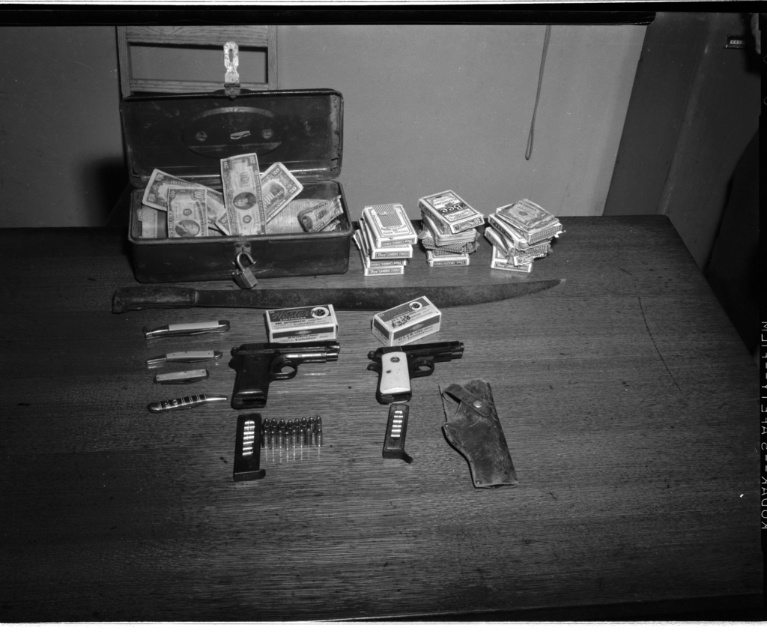
Between metallic suitcase at upper center and polished silver handgun at center, which one has more height?

metallic suitcase at upper center

Does metallic suitcase at upper center have a greater width compared to polished silver handgun at center?

Correct, the width of metallic suitcase at upper center exceeds that of polished silver handgun at center.

This screenshot has width=767, height=640. I want to click on metallic suitcase at upper center, so click(x=219, y=179).

In the scene shown: Does metallic suitcase at upper center have a lesser height compared to polished metal handgun at center?

In fact, metallic suitcase at upper center may be taller than polished metal handgun at center.

Which is in front, point (315, 136) or point (236, 381)?

Positioned in front is point (236, 381).

The width and height of the screenshot is (767, 640). Find the location of `metallic suitcase at upper center`. metallic suitcase at upper center is located at coordinates [219, 179].

Between point (334, 349) and point (392, 387), which one is positioned behind?

Positioned behind is point (334, 349).

What do you see at coordinates (272, 365) in the screenshot?
I see `polished metal handgun at center` at bounding box center [272, 365].

The width and height of the screenshot is (767, 640). What do you see at coordinates (272, 365) in the screenshot?
I see `polished metal handgun at center` at bounding box center [272, 365].

You are a GUI agent. You are given a task and a screenshot of the screen. Output one action in this format:
    pyautogui.click(x=<x>, y=<y>)
    Task: Click on the polished metal handgun at center
    
    Given the screenshot: What is the action you would take?
    pyautogui.click(x=272, y=365)